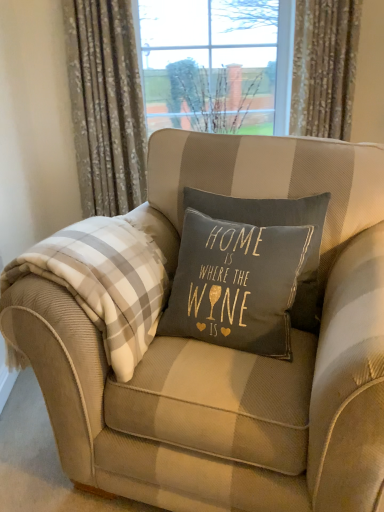
Question: Should I look upward or downward to see floral fabric curtain at upper left, the 1th curtain positioned from the left?

Choices:
 (A) down
 (B) up

Answer: (B)

Question: Is floral fabric curtain at upper left, the 1th curtain positioned from the left, positioned behind white plaid blanket at left?

Choices:
 (A) no
 (B) yes

Answer: (B)

Question: Is floral fabric curtain at upper left, marked as the 2th curtain in a right-to-left arrangement, completely or partially outside of white plaid blanket at left?

Choices:
 (A) yes
 (B) no

Answer: (A)

Question: Could you tell me if floral fabric curtain at upper left, marked as the 2th curtain in a right-to-left arrangement, is facing white plaid blanket at left?

Choices:
 (A) no
 (B) yes

Answer: (B)

Question: Can you confirm if floral fabric curtain at upper left, marked as the 2th curtain in a right-to-left arrangement, is shorter than white plaid blanket at left?

Choices:
 (A) yes
 (B) no

Answer: (B)

Question: Can you confirm if floral fabric curtain at upper left, the 1th curtain positioned from the left, is thinner than white plaid blanket at left?

Choices:
 (A) no
 (B) yes

Answer: (B)

Question: Is floral fabric curtain at upper left, the 1th curtain positioned from the left, in contact with white plaid blanket at left?

Choices:
 (A) yes
 (B) no

Answer: (B)

Question: Is white plaid blanket at left to the right of floral fabric curtain at upper right, which ranks as the first curtain in right-to-left order, from the viewer's perspective?

Choices:
 (A) no
 (B) yes

Answer: (A)

Question: Can you confirm if white plaid blanket at left is positioned to the left of floral fabric curtain at upper right, which ranks as the first curtain in right-to-left order?

Choices:
 (A) no
 (B) yes

Answer: (B)

Question: Considering the relative sizes of white plaid blanket at left and floral fabric curtain at upper right, which is the 2th curtain from left to right, in the image provided, is white plaid blanket at left thinner than floral fabric curtain at upper right, which is the 2th curtain from left to right,?

Choices:
 (A) yes
 (B) no

Answer: (B)

Question: Is white plaid blanket at left smaller than floral fabric curtain at upper right, which is the 2th curtain from left to right?

Choices:
 (A) yes
 (B) no

Answer: (B)

Question: Does white plaid blanket at left lie in front of floral fabric curtain at upper right, which ranks as the first curtain in right-to-left order?

Choices:
 (A) no
 (B) yes

Answer: (B)

Question: Does white plaid blanket at left have a greater height compared to floral fabric curtain at upper right, which is the 2th curtain from left to right?

Choices:
 (A) no
 (B) yes

Answer: (A)

Question: Does beige striped armchair at center have a lesser height compared to floral fabric curtain at upper left, the 1th curtain positioned from the left?

Choices:
 (A) no
 (B) yes

Answer: (B)